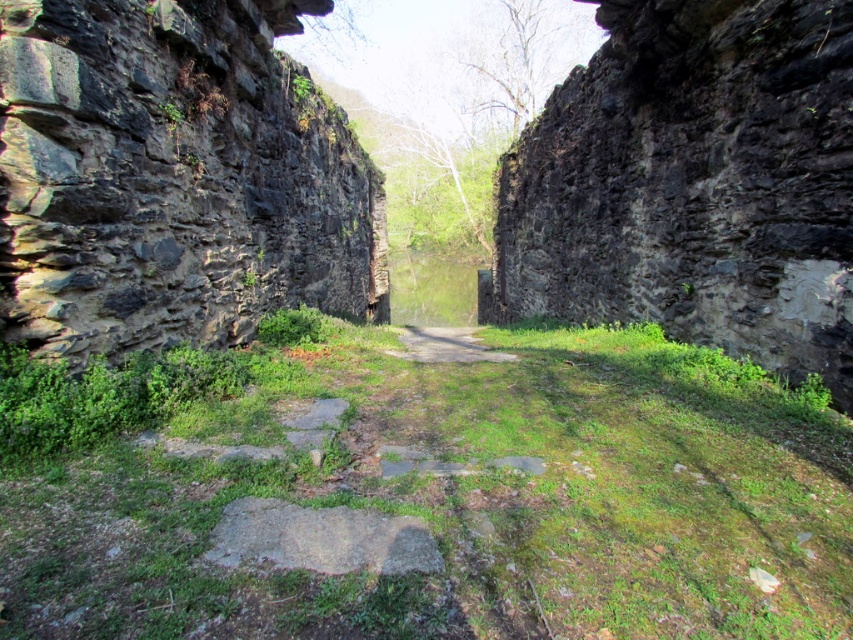
Who is higher up, dark gray rough stone at left or gray rough stone at center?

dark gray rough stone at left is above.

Identify the location of dark gray rough stone at left. This screenshot has height=640, width=853. (173, 177).

Can you confirm if dark gray rough stone at left is positioned to the left of rough stone wall at right?

Yes, dark gray rough stone at left is to the left of rough stone wall at right.

Is point (22, 301) positioned before point (831, 202)?

Yes, point (22, 301) is in front of point (831, 202).

The width and height of the screenshot is (853, 640). In order to click on dark gray rough stone at left in this screenshot , I will do `click(173, 177)`.

Which is more to the right, rough stone wall at right or gray rough stone at center?

Positioned to the right is rough stone wall at right.

Does rough stone wall at right have a lesser height compared to gray rough stone at center?

Incorrect, rough stone wall at right's height does not fall short of gray rough stone at center's.

Describe the element at coordinates (695, 182) in the screenshot. I see `rough stone wall at right` at that location.

Image resolution: width=853 pixels, height=640 pixels. In order to click on rough stone wall at right in this screenshot , I will do `click(695, 182)`.